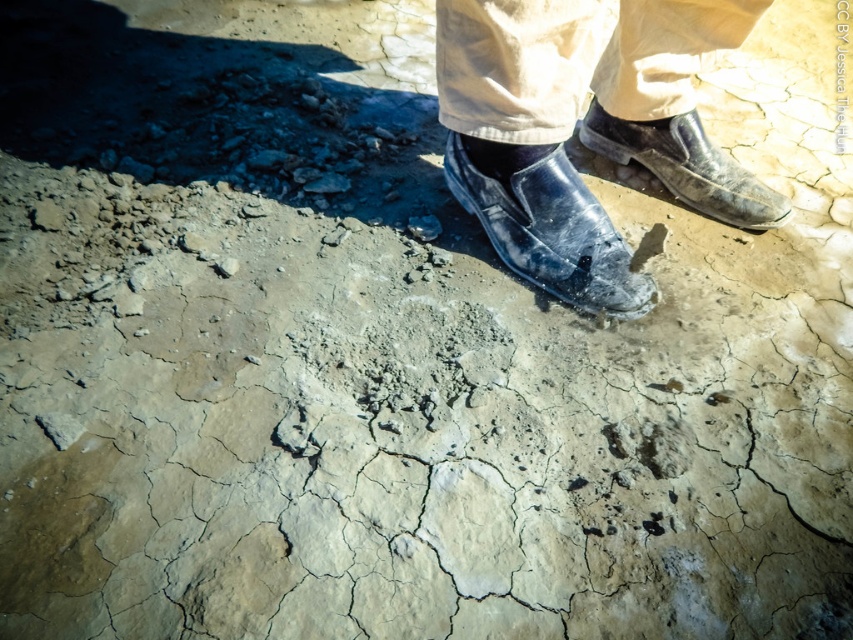
Does shiny black shoes at center have a greater height compared to leather shoes at center?

Yes, shiny black shoes at center is taller than leather shoes at center.

Between point (780, 202) and point (728, 166), which one is positioned in front?

Positioned in front is point (780, 202).

Find the location of a particular element. This screenshot has height=640, width=853. shiny black shoes at center is located at coordinates (584, 129).

Does shiny black slip-on shoe at center appear on the left side of leather shoes at center?

Correct, you'll find shiny black slip-on shoe at center to the left of leather shoes at center.

Which is in front, point (544, 252) or point (735, 168)?

Point (544, 252) is in front.

Where is `shiny black slip-on shoe at center`? This screenshot has width=853, height=640. shiny black slip-on shoe at center is located at coordinates (552, 232).

Is point (660, 13) positioned in front of point (526, 205)?

No, (660, 13) is further to viewer.

Measure the distance between shiny black shoes at center and camera.

A distance of 3.80 feet exists between shiny black shoes at center and camera.

Which is behind, point (469, 184) or point (653, 234)?

Point (653, 234)

The image size is (853, 640). What are the coordinates of `shiny black shoes at center` in the screenshot? It's located at (584, 129).